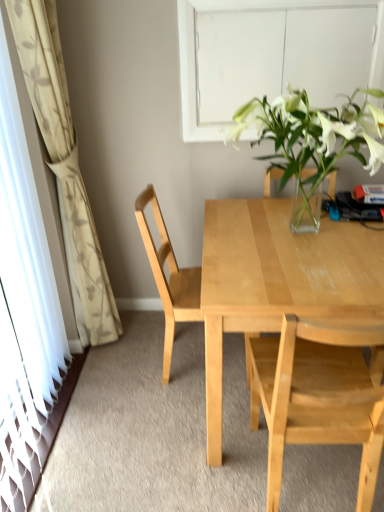
Question: Does transparent glass door at left have a lesser width compared to light wood chair at center, marked as the first chair in a back-to-front arrangement?

Choices:
 (A) yes
 (B) no

Answer: (A)

Question: Is transparent glass door at left further to camera compared to light wood chair at center, the 2th chair positioned from the front?

Choices:
 (A) no
 (B) yes

Answer: (A)

Question: Is transparent glass door at left located outside light wood chair at center, marked as the first chair in a back-to-front arrangement?

Choices:
 (A) yes
 (B) no

Answer: (A)

Question: Is transparent glass door at left at the right side of light wood chair at center, marked as the first chair in a back-to-front arrangement?

Choices:
 (A) yes
 (B) no

Answer: (B)

Question: From the image's perspective, would you say transparent glass door at left is positioned over light wood chair at center, marked as the first chair in a back-to-front arrangement?

Choices:
 (A) yes
 (B) no

Answer: (A)

Question: Is transparent glass door at left facing towards light wood chair at center, the 2th chair positioned from the front?

Choices:
 (A) yes
 (B) no

Answer: (A)

Question: Considering the relative sizes of white floral-patterned curtain at left and light wood desk at center in the image provided, is white floral-patterned curtain at left shorter than light wood desk at center?

Choices:
 (A) no
 (B) yes

Answer: (A)

Question: Could light wood desk at center be considered to be inside white floral-patterned curtain at left?

Choices:
 (A) yes
 (B) no

Answer: (B)

Question: Is white floral-patterned curtain at left at the left side of light wood desk at center?

Choices:
 (A) no
 (B) yes

Answer: (B)

Question: From a real-world perspective, is white floral-patterned curtain at left positioned over light wood desk at center based on gravity?

Choices:
 (A) no
 (B) yes

Answer: (B)

Question: Considering the relative positions of white floral-patterned curtain at left and light wood desk at center in the image provided, is white floral-patterned curtain at left in front of light wood desk at center?

Choices:
 (A) no
 (B) yes

Answer: (A)

Question: Is white floral-patterned curtain at left facing towards light wood desk at center?

Choices:
 (A) no
 (B) yes

Answer: (B)

Question: Is light wood chair at center, placed as the first chair when sorted from front to back, bigger than light wood chair at center, the 2th chair positioned from the front?

Choices:
 (A) yes
 (B) no

Answer: (A)